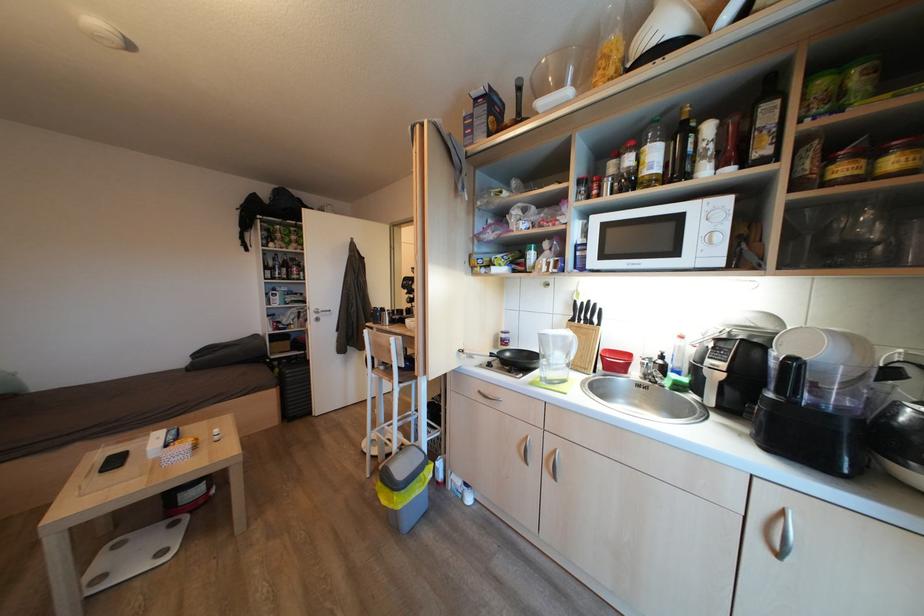
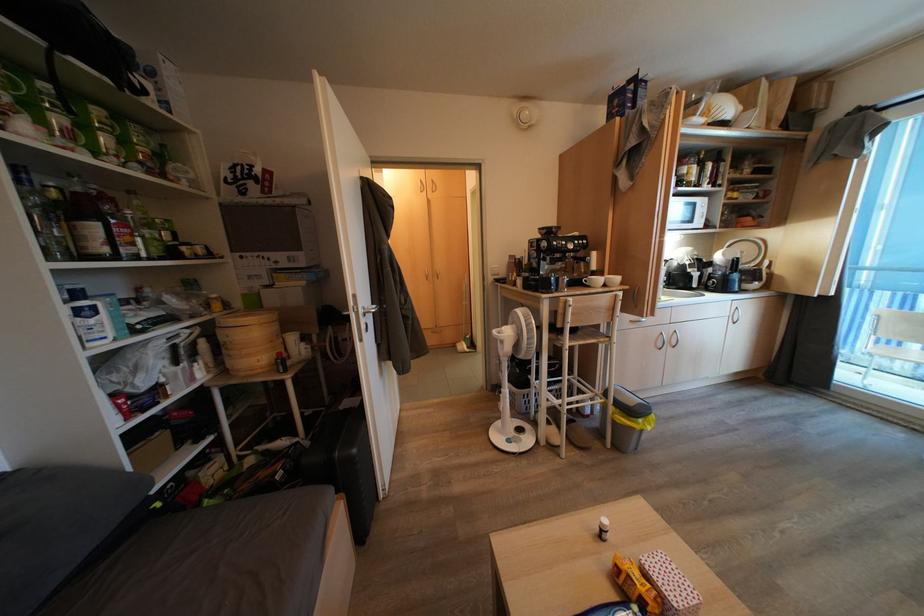
In the second image, find the point that corresponds to point 289,281 in the first image.

(111, 254)